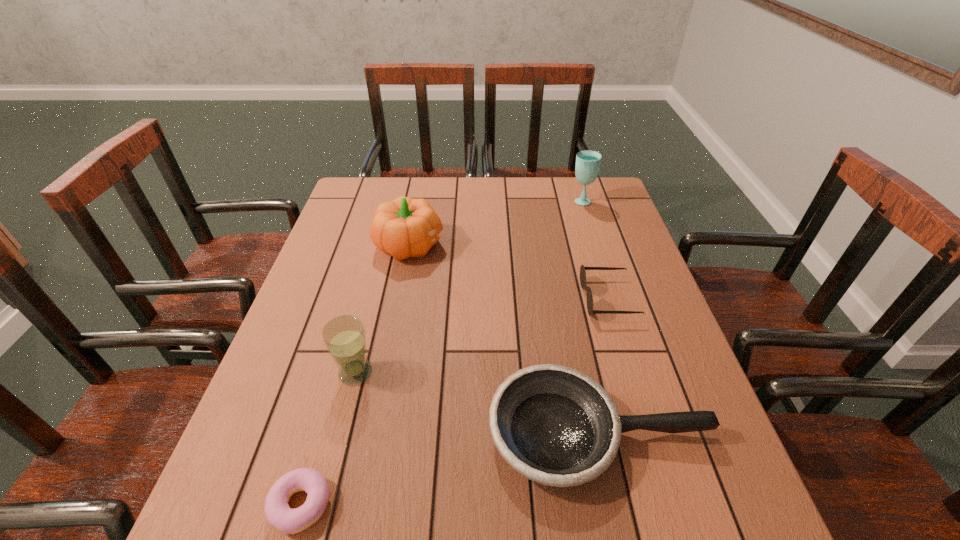
Where is `glass at the right edge`? Image resolution: width=960 pixels, height=540 pixels. glass at the right edge is located at coordinates (588, 162).

You are a GUI agent. You are given a task and a screenshot of the screen. Output one action in this format:
    pyautogui.click(x=<x>, y=<y>)
    Task: Click on the sunglasses present at the right edge
    Image resolution: width=960 pixels, height=540 pixels.
    Given the screenshot: What is the action you would take?
    pyautogui.click(x=583, y=284)

This screenshot has width=960, height=540. Identify the location of frying pan that is at the right edge. (554, 425).

Locate an element on the screen. The height and width of the screenshot is (540, 960). object present at the near left corner is located at coordinates (278, 513).

Identify the location of object at the far right corner. (588, 162).

The image size is (960, 540). What are the coordinates of `vacant space at the far edge of the desktop` in the screenshot? It's located at (511, 190).

In order to click on vacant point at the left edge in this screenshot , I will do `click(280, 357)`.

You are a GUI agent. You are given a task and a screenshot of the screen. Output one action in this format:
    pyautogui.click(x=<x>, y=<y>)
    Task: Click on the vacant space at the right edge
    
    Given the screenshot: What is the action you would take?
    pyautogui.click(x=675, y=358)

In the image, there is a desktop. Where is `vacant space at the far left corner`? The image size is (960, 540). vacant space at the far left corner is located at coordinates (357, 210).

Where is `vacant region at the near right corner`? The image size is (960, 540). vacant region at the near right corner is located at coordinates (683, 507).